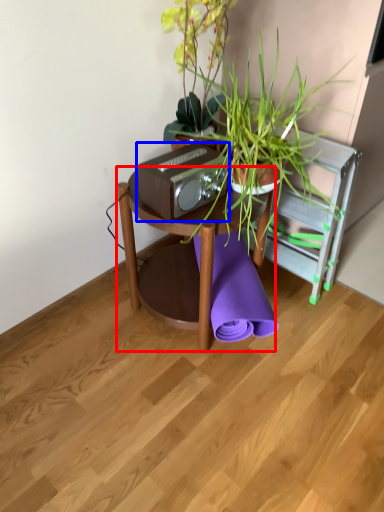
Question: Which of the following is the closest to the observer, table (highlighted by a red box) or stereo (highlighted by a blue box)?

Choices:
 (A) table
 (B) stereo

Answer: (B)